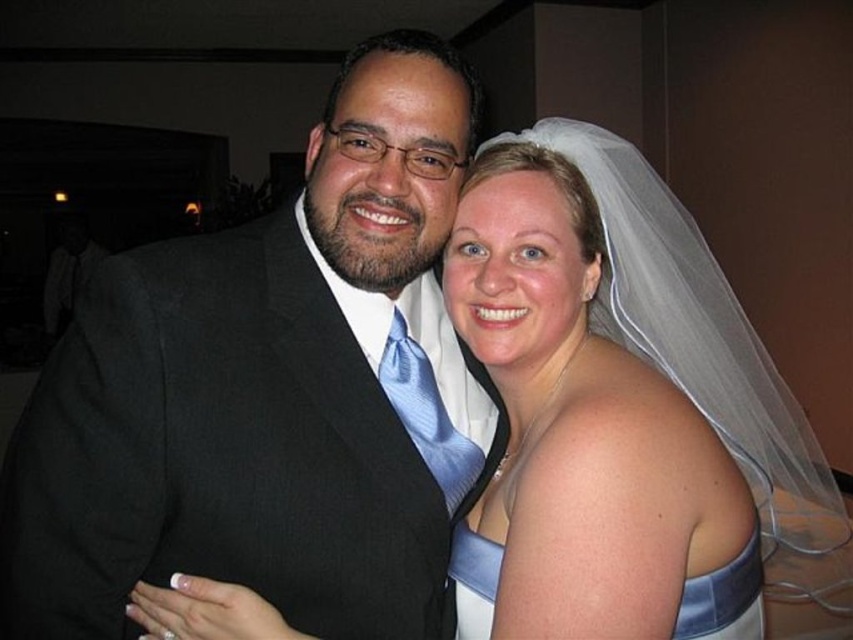
You are a photographer at a wedding reception. You need to position two white satin dresses for a group photo. The white satin dress at center and the white satin dress at lower right. Which dress should you place closer to the camera to make them appear the same size in the photo?

To make the white satin dress at center and the white satin dress at lower right appear the same size in the photo, you should place the smaller white satin dress at lower right closer to the camera since the white satin dress at center is larger in size.

You are a photographer adjusting the camera focus. The white satin dress at center is the main subject. Where should you aim the focus point to ensure it captures the dress perfectly?

The white satin dress at center is located at point (585, 422), so you should aim the focus point there to capture it perfectly.

You are a photographer adjusting your camera settings. You need to focus on the black suit at center. The camera is currently 31.44 inches away. Is this distance within the typical autofocus range of a standard DSLR camera?

The distance between the black suit at center and the camera is 31.44 inches. Standard DSLR cameras typically have an autofocus range starting from about 3.3 feet or closer. Since 31.44 inches is approximately 2.62 feet, which is within the typical autofocus range, the camera should be able to focus on the black suit at center.